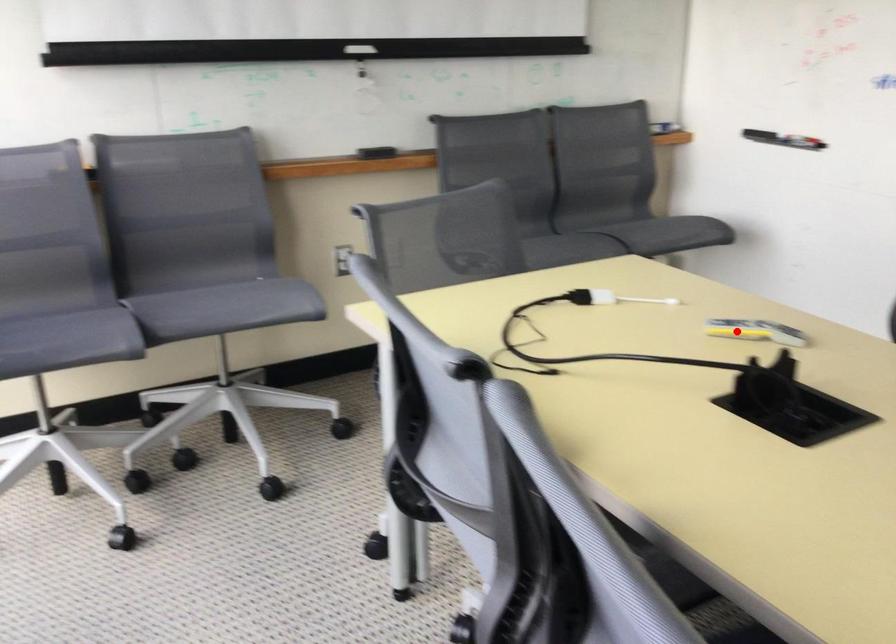
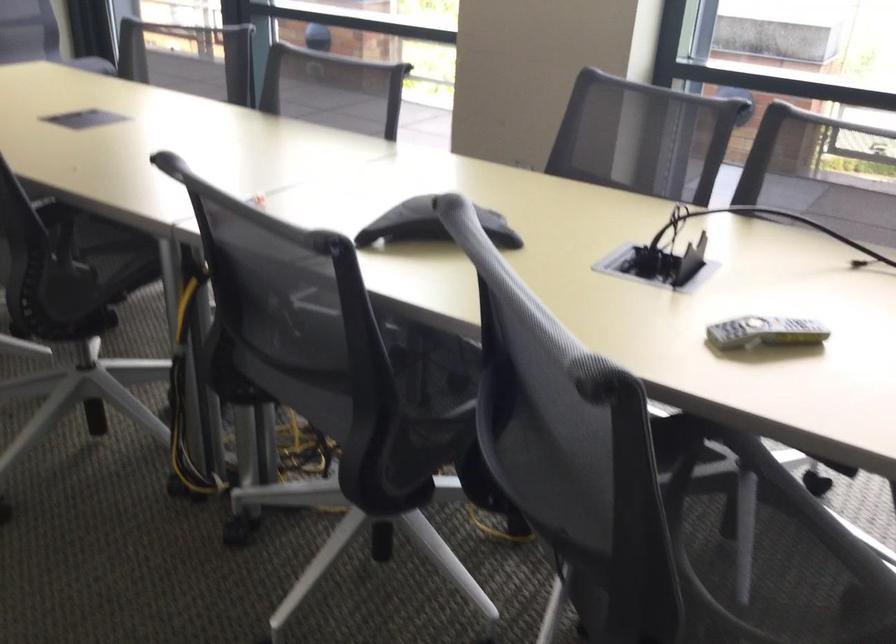
In the second image, find the point that corresponds to the highlighted location in the first image.

(764, 332)